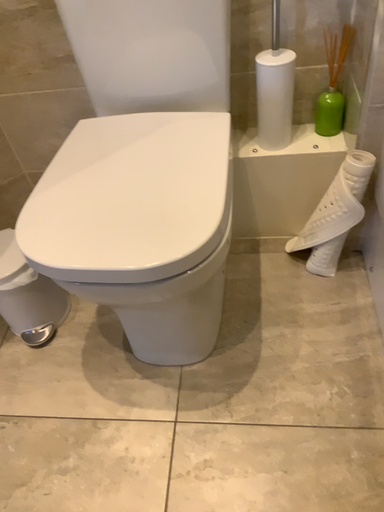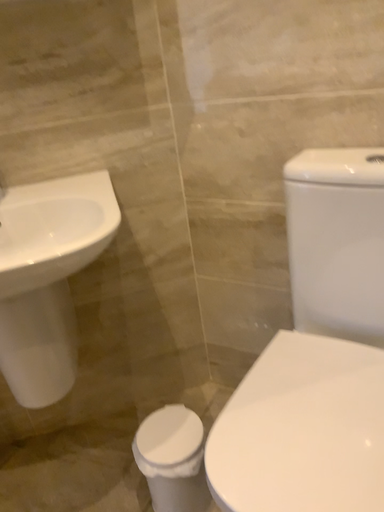
Question: Which way did the camera rotate in the video?

Choices:
 (A) rotated upward
 (B) rotated downward

Answer: (A)